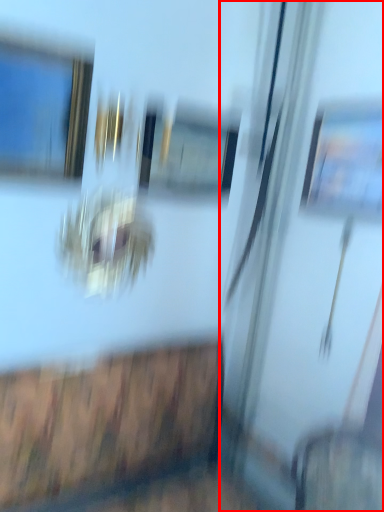
Question: From the image's perspective, where is screen door (annotated by the red box) located relative to window?

Choices:
 (A) above
 (B) below

Answer: (B)